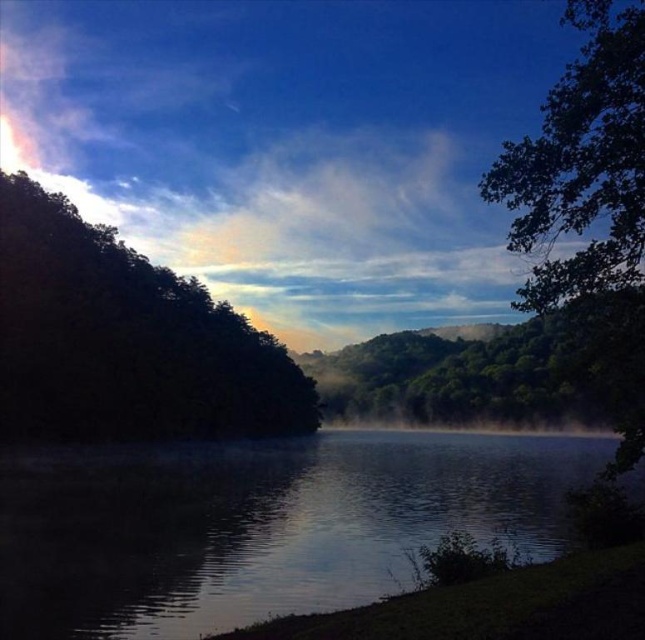
Question: Which point is farther to the camera?

Choices:
 (A) green leafy tree at center
 (B) green leafy tree at upper right

Answer: (A)

Question: From the image, what is the correct spatial relationship of mist at center in relation to dark reflective water at center?

Choices:
 (A) left
 (B) right

Answer: (A)

Question: Does mist at center have a greater width compared to dark green leafy tree at left?

Choices:
 (A) yes
 (B) no

Answer: (A)

Question: Which point is closer to the camera?

Choices:
 (A) dark reflective water at center
 (B) dark green leafy tree at left

Answer: (A)

Question: Which point is closer to the camera?

Choices:
 (A) (288, 376)
 (B) (531, 412)
 (C) (204, 464)
 (D) (600, 108)

Answer: (D)

Question: Does dark reflective water at center have a smaller size compared to green leafy tree at upper right?

Choices:
 (A) no
 (B) yes

Answer: (B)